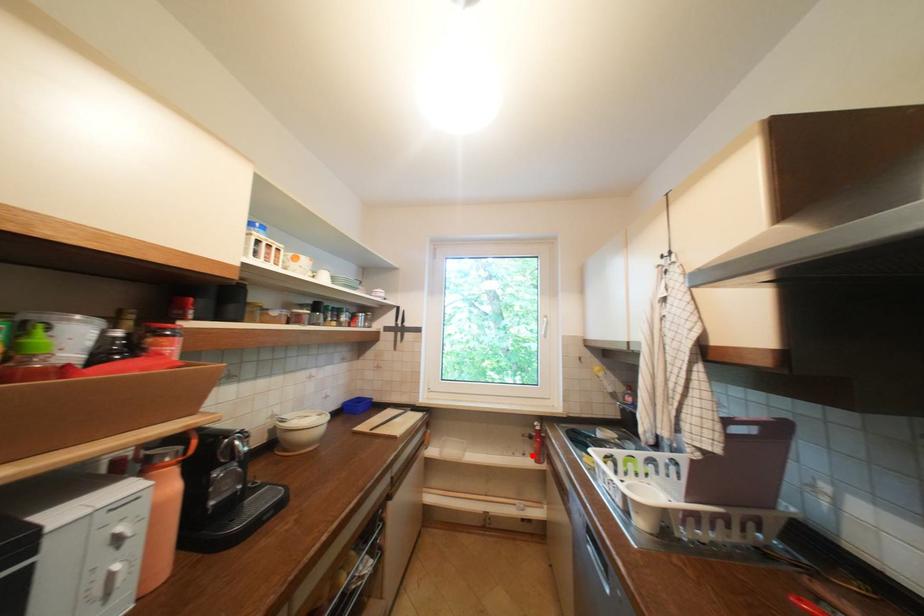
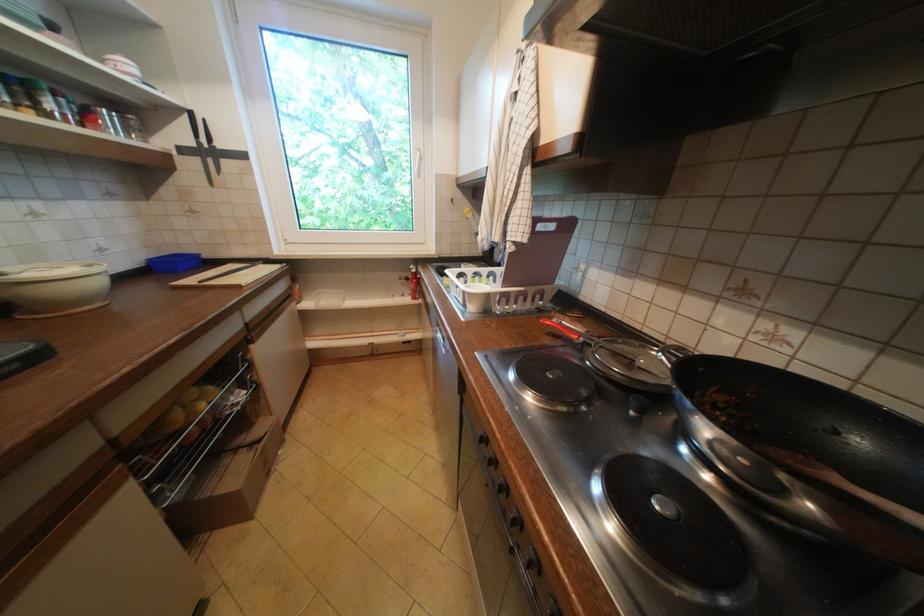
Question: I am providing you with two images of the same scene from different viewpoints. In image1, a red point is highlighted. Considering the same 3D point in image2, which of the following is correct?

Choices:
 (A) It is closer
 (B) It is farther

Answer: (A)